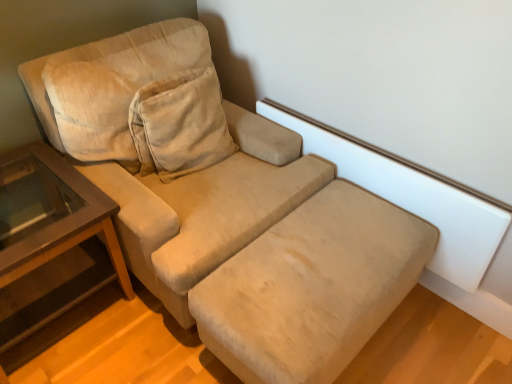
Question: Is beige fabric footrest at lower center inside or outside of brown wood table at left?

Choices:
 (A) outside
 (B) inside

Answer: (A)

Question: Is beige fabric footrest at lower center in front of or behind brown wood table at left in the image?

Choices:
 (A) front
 (B) behind

Answer: (A)

Question: Is beige fabric footrest at lower center bigger or smaller than brown wood table at left?

Choices:
 (A) big
 (B) small

Answer: (B)

Question: From a real-world perspective, is brown wood table at left positioned above or below beige fabric footrest at lower center?

Choices:
 (A) below
 (B) above

Answer: (B)

Question: Is brown wood table at left bigger or smaller than beige fabric footrest at lower center?

Choices:
 (A) big
 (B) small

Answer: (A)

Question: Does point (13, 251) appear closer or farther from the camera than point (258, 326)?

Choices:
 (A) farther
 (B) closer

Answer: (A)

Question: Considering the positions of brown wood table at left and beige fabric footrest at lower center in the image, is brown wood table at left wider or thinner than beige fabric footrest at lower center?

Choices:
 (A) wide
 (B) thin

Answer: (A)